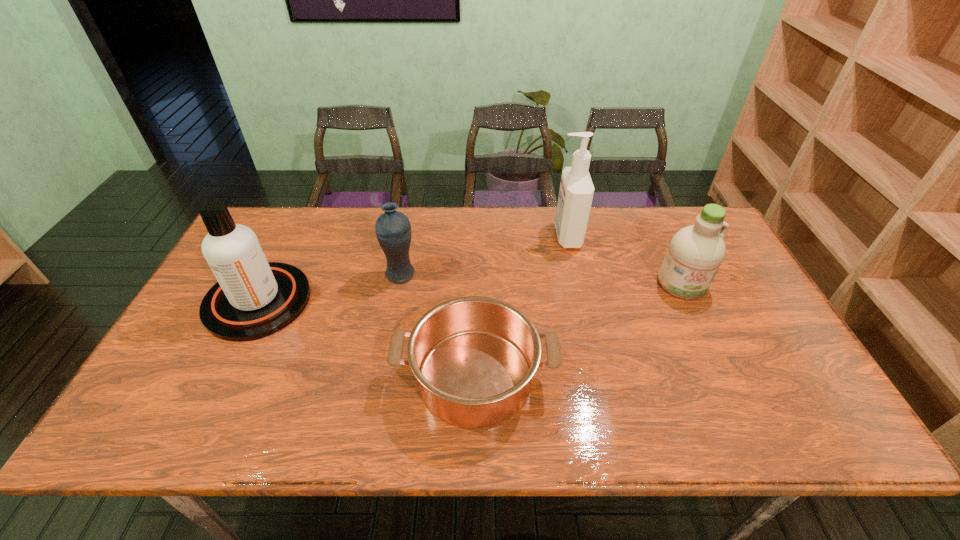
Locate an element on the screen. The width and height of the screenshot is (960, 540). the farthest cleansing agent is located at coordinates (576, 191).

What are the coordinates of `the farthest object` in the screenshot? It's located at (576, 191).

At what (x,y) coordinates should I click in order to perform the action: click on the leftmost object. Please return your answer as a coordinate pair (x, y). Looking at the image, I should click on (253, 298).

Where is `the shortest cleansing agent`? The height and width of the screenshot is (540, 960). the shortest cleansing agent is located at coordinates [x=695, y=253].

I want to click on the rightmost cleansing agent, so click(695, 253).

Where is `vase`? The image size is (960, 540). vase is located at coordinates (393, 231).

Where is `the shortest object`? the shortest object is located at coordinates (474, 358).

Where is `free spot located 0.060m on the front label of the second object from right to left`? The width and height of the screenshot is (960, 540). free spot located 0.060m on the front label of the second object from right to left is located at coordinates (535, 236).

Locate an element on the screen. vacant position located on the front label of the second object from right to left is located at coordinates (474, 236).

Where is `blank space located on the front label of the second object from right to left`? The width and height of the screenshot is (960, 540). blank space located on the front label of the second object from right to left is located at coordinates (504, 236).